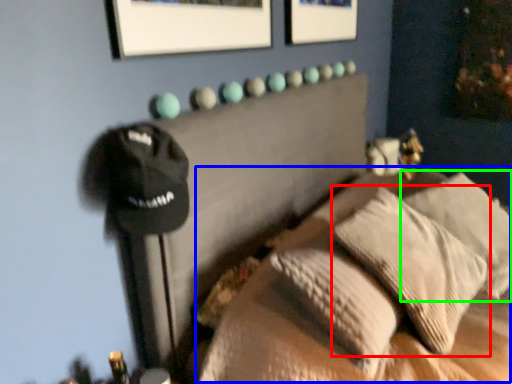
Question: Based on their relative distances, which object is nearer to pillow (highlighted by a red box)? Choose from bed (highlighted by a blue box) and pillow (highlighted by a green box).

Choices:
 (A) bed
 (B) pillow

Answer: (A)